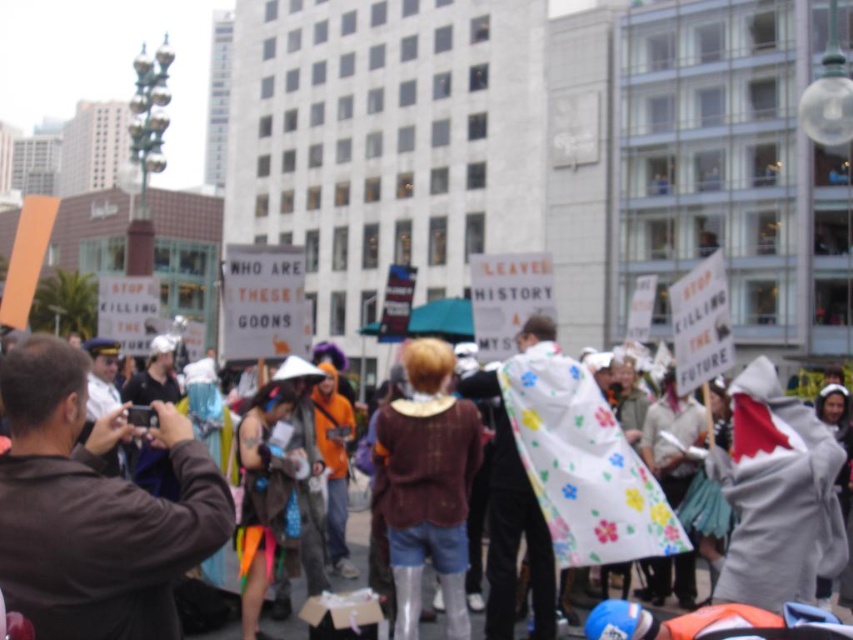
You are a photographer trying to capture a clear shot of both the brown leather jacket at left and the brown leather jacket at center. However, you notice that one is blocking the other. Which jacket is obstructing the view of the other?

The brown leather jacket at left is positioned under the brown leather jacket at center, so the brown leather jacket at center is obstructing the view of the brown leather jacket at left.

In the protest scene, there are two people wearing brown leather jackets. One is at the left side of the image, and the other is at the center. From the perspective of someone standing in the scene, which direction should they turn to face the brown leather jacket at left from the brown leather jacket at center?

To face the brown leather jacket at left from the brown leather jacket at center, you should turn to your right, as the brown leather jacket at left is positioned to the right of the brown leather jacket at center.